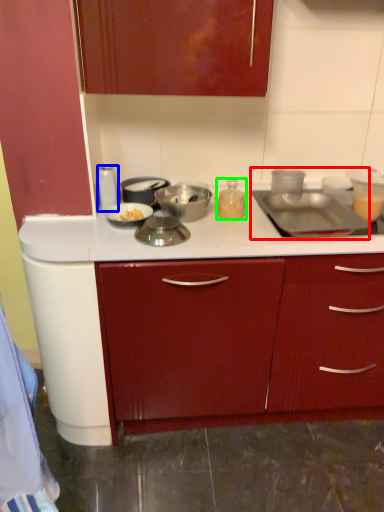
Question: Estimate the real-world distances between objects in this image. Which object is closer to sink (highlighted by a red box), kitchen appliance (highlighted by a blue box) or kitchen appliance (highlighted by a green box)?

Choices:
 (A) kitchen appliance
 (B) kitchen appliance

Answer: (B)